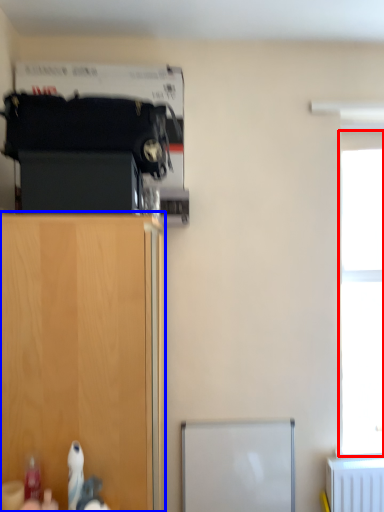
Question: Which of the following is the farthest to the observer, window (highlighted by a red box) or cupboard (highlighted by a blue box)?

Choices:
 (A) window
 (B) cupboard

Answer: (A)